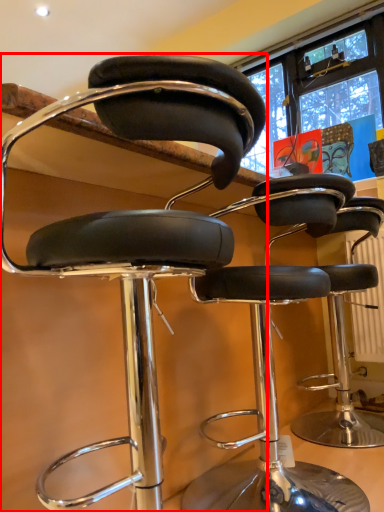
Question: Observing the image, what is the correct spatial positioning of chair (annotated by the red box) in reference to chair?

Choices:
 (A) left
 (B) right

Answer: (A)